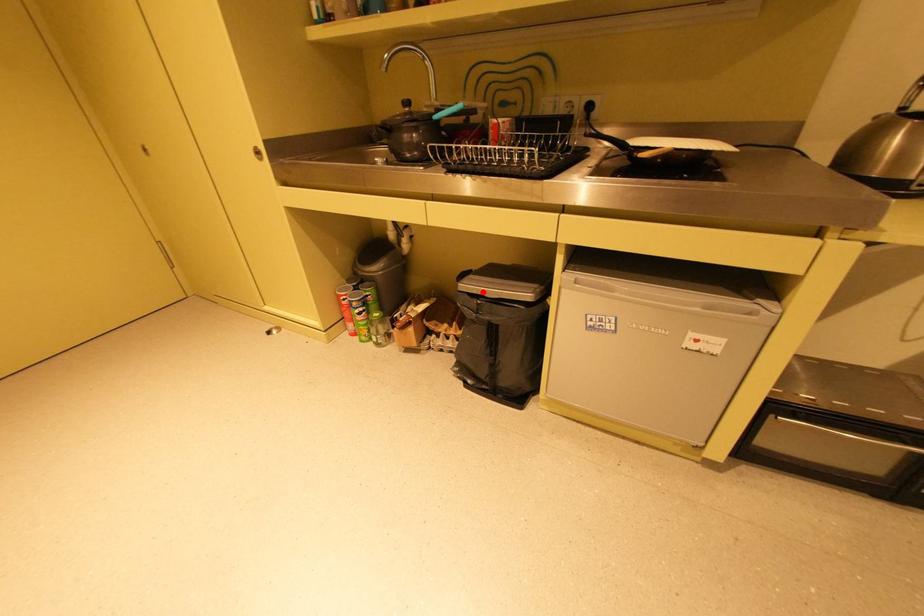
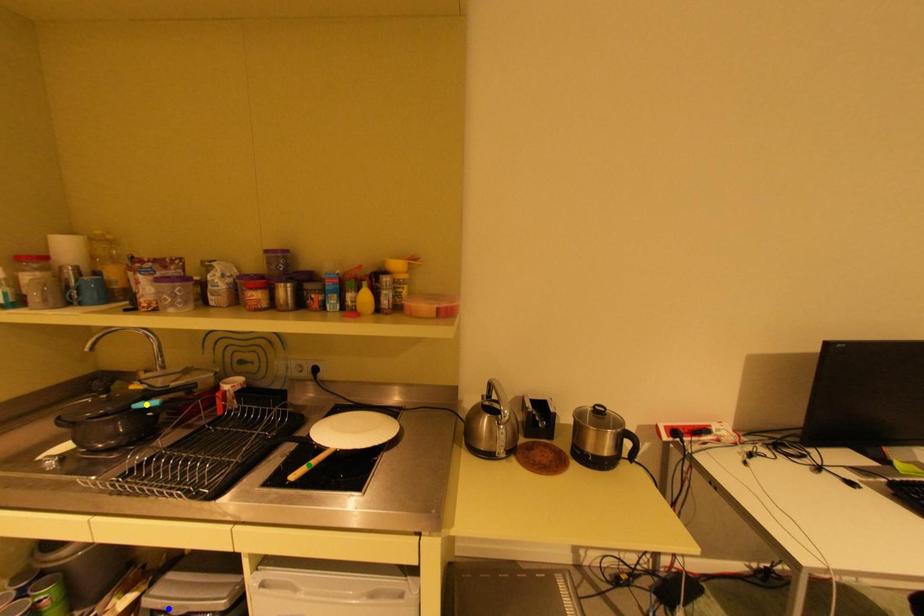
Question: I am providing you with two images of the same scene from different viewpoints. A red point is marked on the first image. You are given multiple points on the second image. Which spot in image 2 lines up with the point in image 1?

Choices:
 (A) yellow point
 (B) blue point
 (C) green point

Answer: (B)